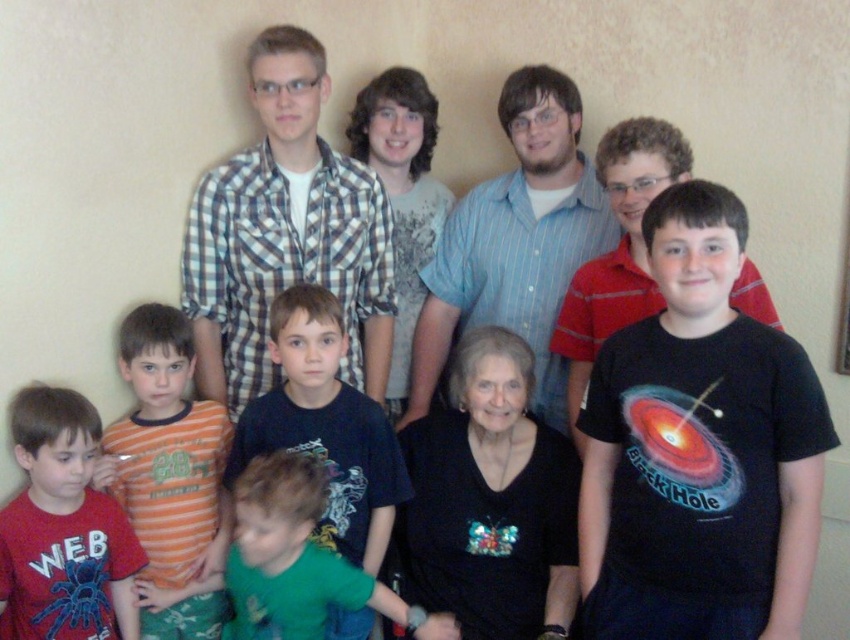
The width and height of the screenshot is (850, 640). What do you see at coordinates (64, 528) in the screenshot? I see `matte red t-shirt at lower left` at bounding box center [64, 528].

Between matte red t-shirt at lower left and dark blue t-shirt at center, which one has more height?

dark blue t-shirt at center is taller.

Which is in front, point (106, 632) or point (340, 428)?

Point (106, 632) is in front.

You are a GUI agent. You are given a task and a screenshot of the screen. Output one action in this format:
    pyautogui.click(x=<x>, y=<y>)
    Task: Click on the matte red t-shirt at lower left
    This screenshot has height=640, width=850.
    Given the screenshot: What is the action you would take?
    [x=64, y=528]

Does checkered fabric shirt at upper center have a smaller size compared to dark blue t-shirt at center?

Actually, checkered fabric shirt at upper center might be larger than dark blue t-shirt at center.

Find the location of `checkered fabric shirt at upper center`. checkered fabric shirt at upper center is located at coordinates (285, 234).

Locate an element on the screen. Image resolution: width=850 pixels, height=640 pixels. checkered fabric shirt at upper center is located at coordinates (285, 234).

Between black matte t-shirt at center and green fabric shirt at lower center, which one is positioned higher?

black matte t-shirt at center is above.

In the scene shown: Can you confirm if black matte t-shirt at center is thinner than green fabric shirt at lower center?

Indeed, black matte t-shirt at center has a lesser width compared to green fabric shirt at lower center.

The image size is (850, 640). What do you see at coordinates (700, 449) in the screenshot?
I see `black matte t-shirt at center` at bounding box center [700, 449].

Locate an element on the screen. The height and width of the screenshot is (640, 850). black matte t-shirt at center is located at coordinates (700, 449).